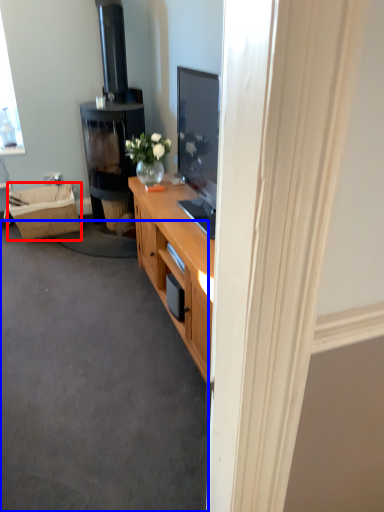
Question: Which object is closer to the camera taking this photo, picnic basket (highlighted by a red box) or plain (highlighted by a blue box)?

Choices:
 (A) picnic basket
 (B) plain

Answer: (B)